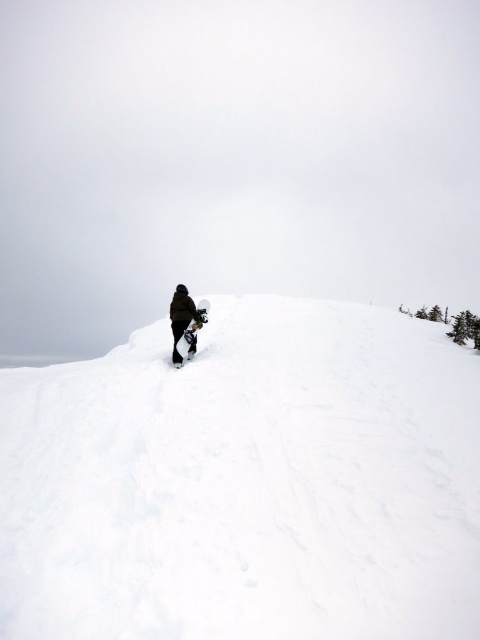
Between white fluffy snow at center and dark brown snowboarder at center, which one is positioned higher?

dark brown snowboarder at center is above.

Is white fluffy snow at center to the right of dark brown snowboarder at center from the viewer's perspective?

Indeed, white fluffy snow at center is positioned on the right side of dark brown snowboarder at center.

Identify the location of white fluffy snow at center. (245, 483).

You are a GUI agent. You are given a task and a screenshot of the screen. Output one action in this format:
    pyautogui.click(x=<x>, y=<y>)
    Task: Click on the white fluffy snow at center
    This screenshot has width=480, height=640.
    Given the screenshot: What is the action you would take?
    pyautogui.click(x=245, y=483)